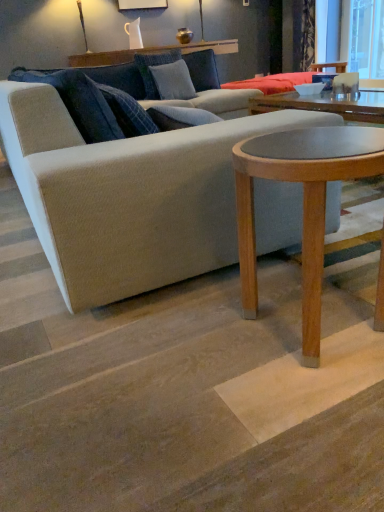
The width and height of the screenshot is (384, 512). What are the coordinates of `space that is in front of light brown wood coffee table at center` in the screenshot? It's located at (297, 425).